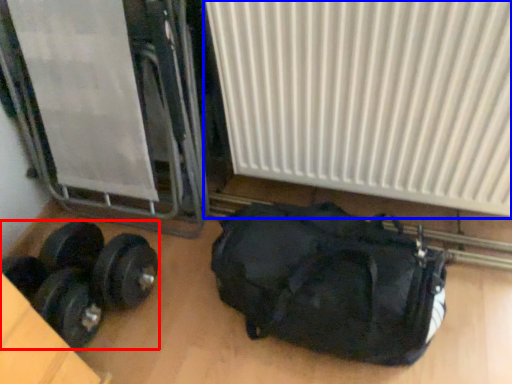
Question: Which object is closer to the camera taking this photo, dumbbell (highlighted by a red box) or radiator (highlighted by a blue box)?

Choices:
 (A) dumbbell
 (B) radiator

Answer: (B)